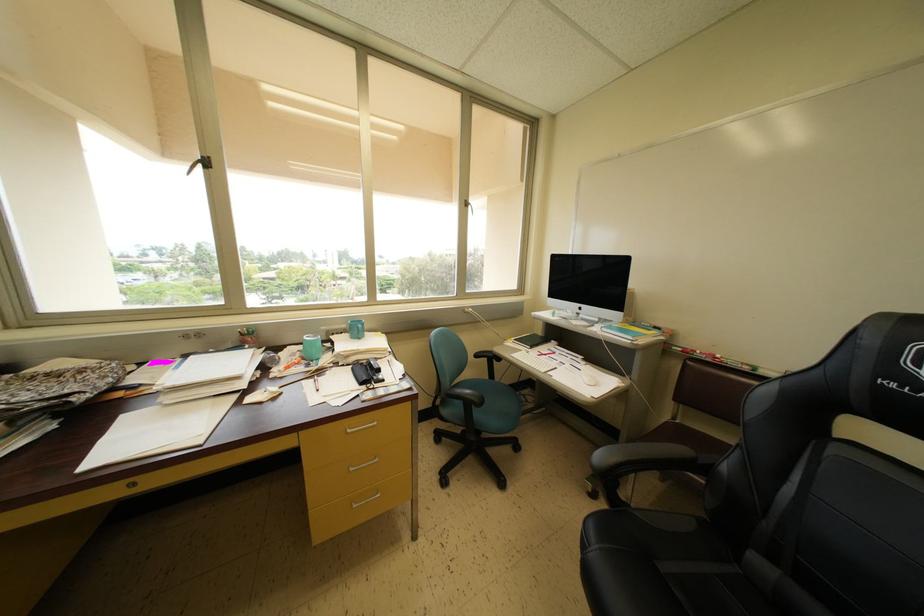
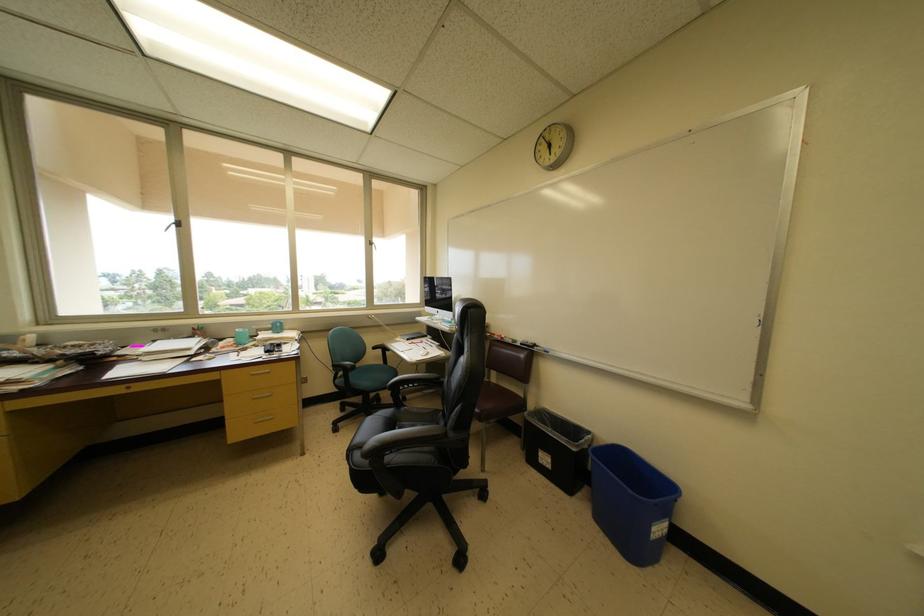
Which direction would the cameraman need to move to produce the second image?

The movement direction of the cameraman is right, backward.